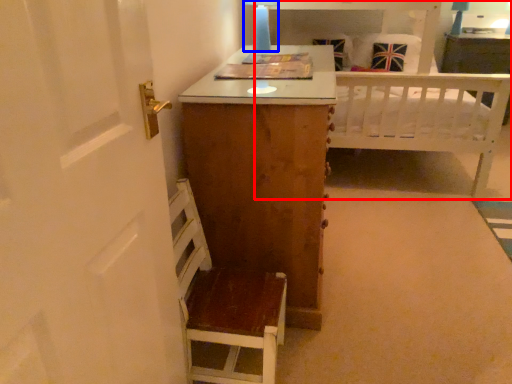
Question: Which point is closer to the camera, bed (highlighted by a red box) or table lamp (highlighted by a blue box)?

Choices:
 (A) bed
 (B) table lamp

Answer: (B)